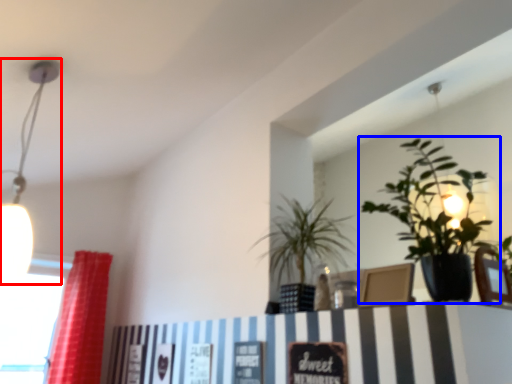
Question: Which of the following is the farthest to the observer, lamp (highlighted by a red box) or houseplant (highlighted by a blue box)?

Choices:
 (A) lamp
 (B) houseplant

Answer: (A)